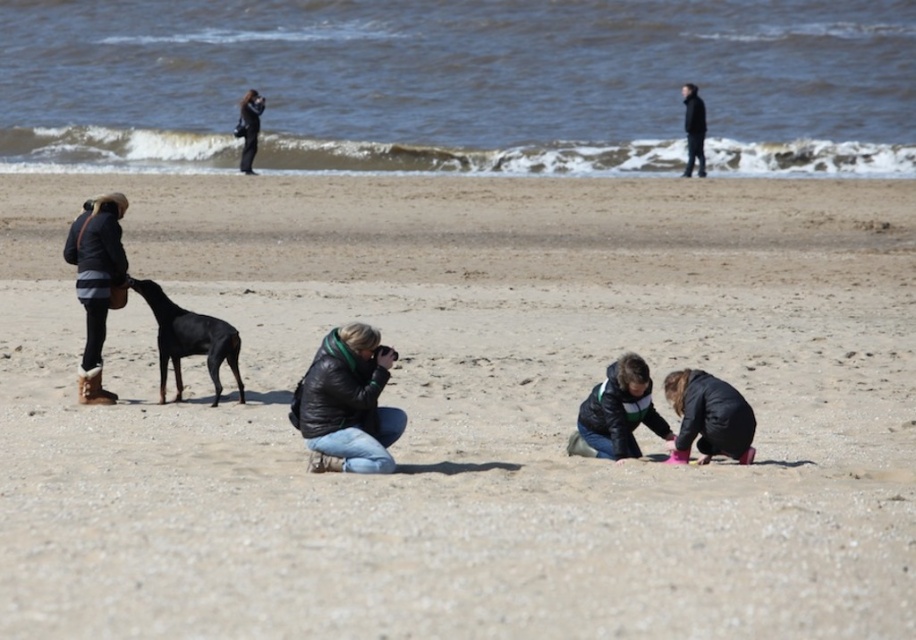
Between point (243, 490) and point (167, 301), which one is positioned behind?

The point (167, 301) is more distant.

Who is shorter, fine-grained sand at center or shiny black dog at left?

Standing shorter between the two is shiny black dog at left.

Which is in front, point (793, 237) or point (162, 385)?

Point (162, 385) is more forward.

You are a GUI agent. You are given a task and a screenshot of the screen. Output one action in this format:
    pyautogui.click(x=<x>, y=<y>)
    Task: Click on the fine-grained sand at center
    The image size is (916, 640).
    Given the screenshot: What is the action you would take?
    pyautogui.click(x=466, y=410)

Can you confirm if brown leather jacket at left is shorter than matte black jacket at lower right?

No, brown leather jacket at left is not shorter than matte black jacket at lower right.

Between brown leather jacket at left and matte black jacket at lower right, which one appears on the right side from the viewer's perspective?

From the viewer's perspective, matte black jacket at lower right appears more on the right side.

Who is more forward, [75,230] or [696,372]?

Point [696,372] is more forward.

Locate an element on the screen. brown leather jacket at left is located at coordinates (96, 282).

Is brown leather jacket at left to the left of black leather jacket at upper right from the viewer's perspective?

Yes, brown leather jacket at left is to the left of black leather jacket at upper right.

Between point (104, 204) and point (696, 170), which one is positioned in front?

Point (104, 204) is more forward.

Between point (95, 330) and point (683, 173), which one is positioned in front?

Point (95, 330) is more forward.

In order to click on brown leather jacket at left in this screenshot , I will do `click(96, 282)`.